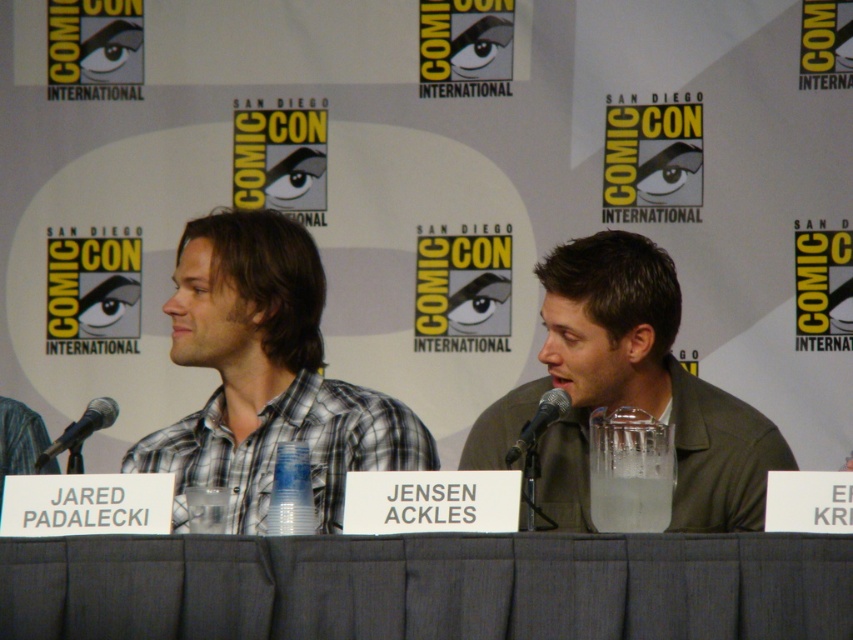
Question: Which object appears farthest from the camera in this image?

Choices:
 (A) plaid cotton shirt at center
 (B) black metallic microphone at left

Answer: (A)

Question: Does gray fabric table at center appear on the right side of black metallic microphone at left?

Choices:
 (A) no
 (B) yes

Answer: (B)

Question: Is gray fabric table at center thinner than plaid cotton shirt at center?

Choices:
 (A) no
 (B) yes

Answer: (A)

Question: Which of these objects is positioned farthest from the black metallic microphone at center?

Choices:
 (A) plaid cotton shirt at center
 (B) green matte jacket at center
 (C) black metallic microphone at left
 (D) gray fabric table at center

Answer: (A)

Question: Which of these objects is positioned farthest from the green matte jacket at center?

Choices:
 (A) gray fabric table at center
 (B) plaid cotton shirt at center
 (C) black metallic microphone at center
 (D) black metallic microphone at left

Answer: (D)

Question: Is gray fabric table at center above plaid cotton shirt at center?

Choices:
 (A) yes
 (B) no

Answer: (B)